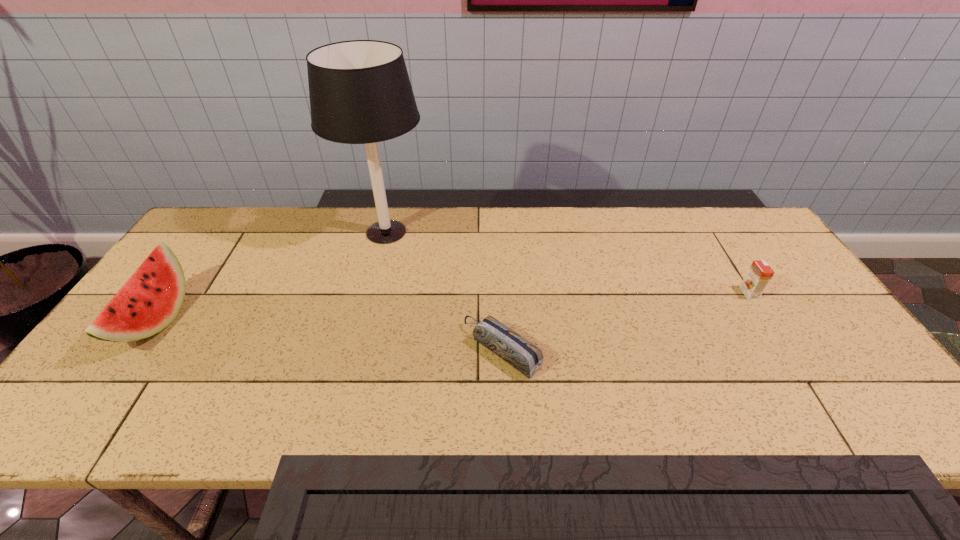
Locate an element on the screen. free region at the far right corner of the desktop is located at coordinates (727, 214).

Where is `free point between the pencil box and the third tallest object`? free point between the pencil box and the third tallest object is located at coordinates (626, 322).

What are the coordinates of `free space between the third object from right to left and the leftmost object` in the screenshot? It's located at (272, 276).

Where is `vacant area between the pencil box and the rightmost object`? This screenshot has height=540, width=960. vacant area between the pencil box and the rightmost object is located at coordinates (626, 322).

I want to click on empty location between the pencil box and the rightmost object, so click(626, 322).

This screenshot has width=960, height=540. I want to click on free spot between the leftmost object and the third object from right to left, so click(x=272, y=276).

This screenshot has width=960, height=540. I want to click on free point between the second object from right to left and the farthest object, so click(x=444, y=291).

Identify the location of vacant region between the third tallest object and the tallest object. The width and height of the screenshot is (960, 540). (567, 262).

Find the location of a particular element. The height and width of the screenshot is (540, 960). free spot between the second tallest object and the rightmost object is located at coordinates (453, 307).

You are a GUI agent. You are given a task and a screenshot of the screen. Output one action in this format:
    pyautogui.click(x=<x>, y=<y>)
    Task: Click on the empty location between the third object from right to left and the third object from left to right
    
    Given the screenshot: What is the action you would take?
    pyautogui.click(x=444, y=291)